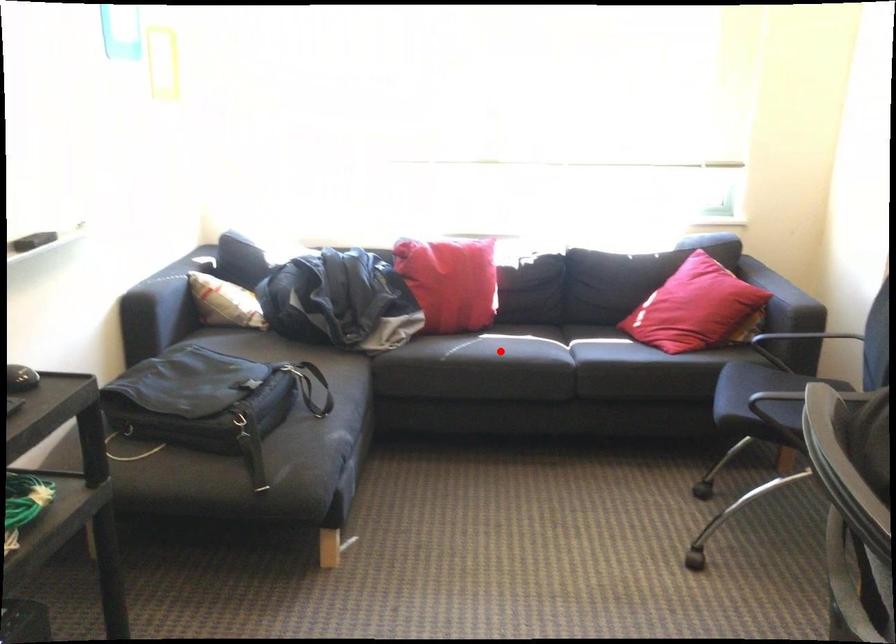
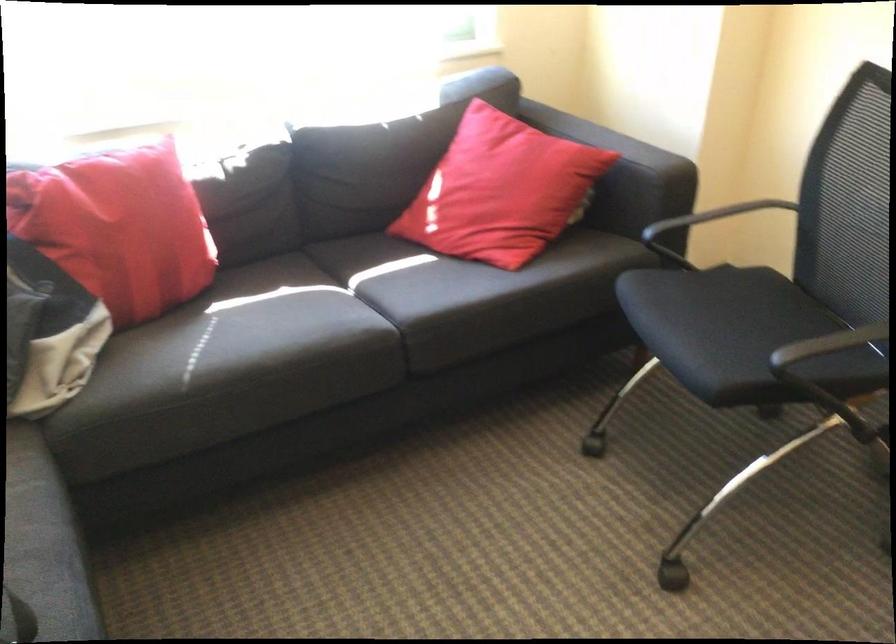
Question: I am providing you with two images of the same scene from different viewpoints. Given a red point in image1, look at the same physical point in image2. Is it:

Choices:
 (A) Closer to the viewpoint
 (B) Farther from the viewpoint

Answer: (A)